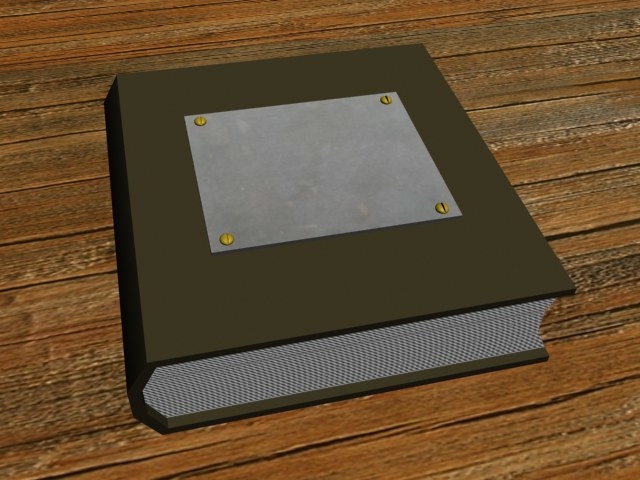
Where is `table`? table is located at coordinates (571, 422).